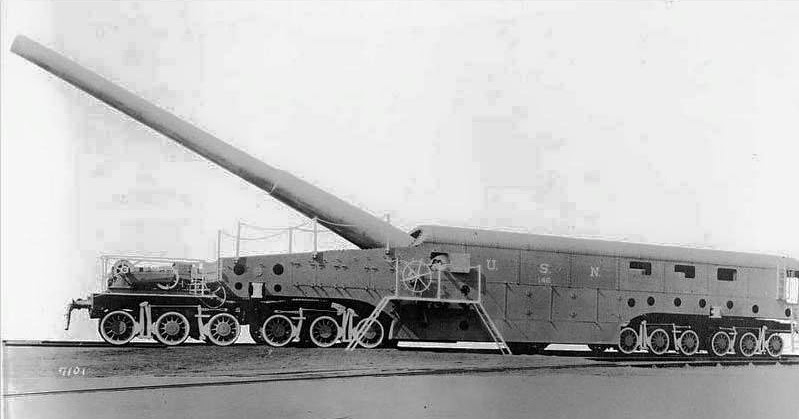
Where is `small open door`? The image size is (799, 419). small open door is located at coordinates (451, 261).